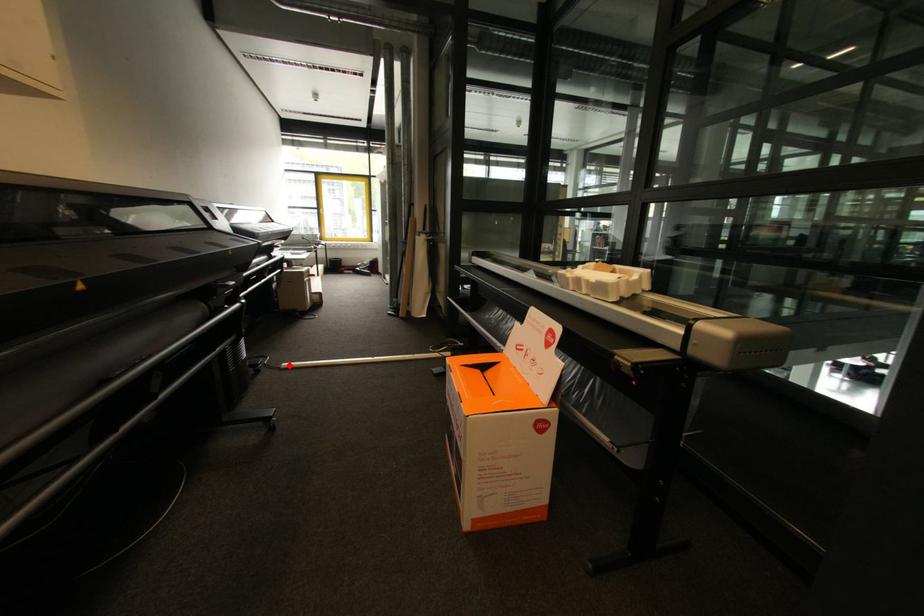
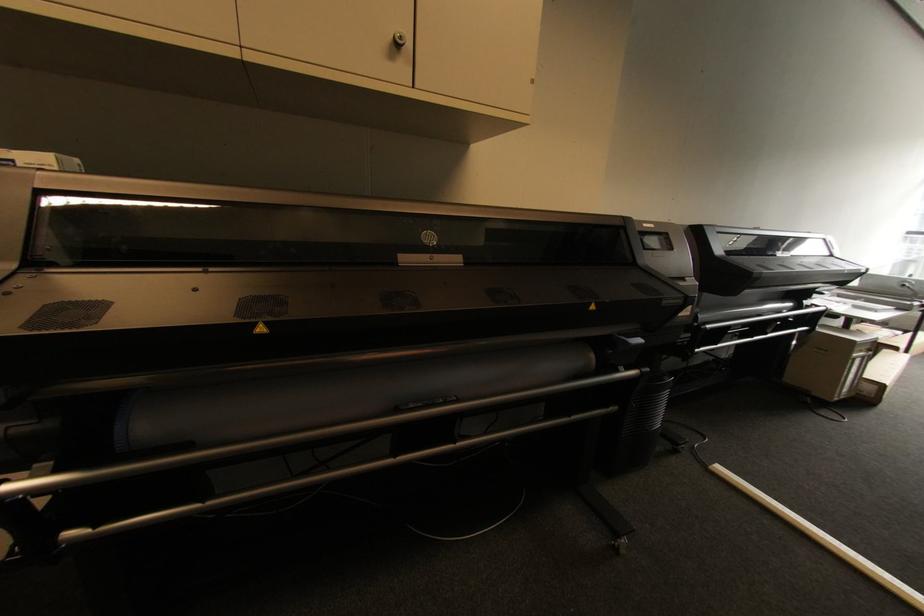
Locate, in the second image, the point that corresponds to the highlighted location in the first image.

(723, 469)